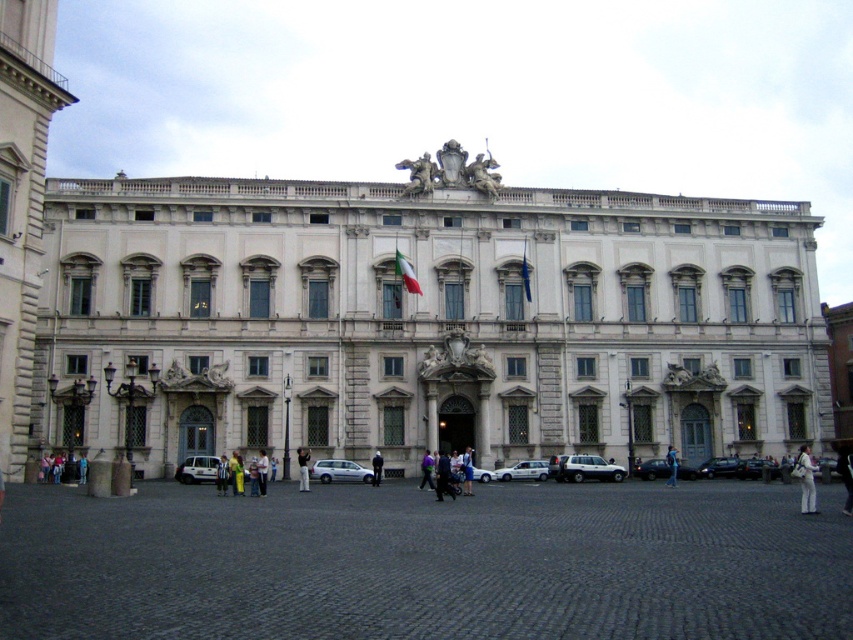
How far apart are white fabric bag at lower right and white matte car at lower center?

white fabric bag at lower right is 20.41 meters away from white matte car at lower center.

Can you confirm if white fabric bag at lower right is positioned below white matte car at lower center?

Indeed, white fabric bag at lower right is positioned under white matte car at lower center.

Which is behind, point (813, 508) or point (519, 461)?

Positioned behind is point (519, 461).

Identify the location of white fabric bag at lower right. (805, 480).

Is metallic silver sedan at center-right closer to the viewer compared to yellow fabric bag at lower center?

No, metallic silver sedan at center-right is behind yellow fabric bag at lower center.

Who is shorter, metallic silver sedan at center-right or yellow fabric bag at lower center?

metallic silver sedan at center-right is shorter.

This screenshot has height=640, width=853. I want to click on metallic silver sedan at center-right, so click(759, 468).

Looking at this image, does white matte van at center have a smaller size compared to white fabric bag at center?

No.

Is the position of white matte van at center less distant than that of white fabric bag at center?

That is False.

Between point (363, 481) and point (276, 467), which one is positioned in front?

Point (276, 467)

The image size is (853, 640). I want to click on white matte van at center, so click(x=339, y=472).